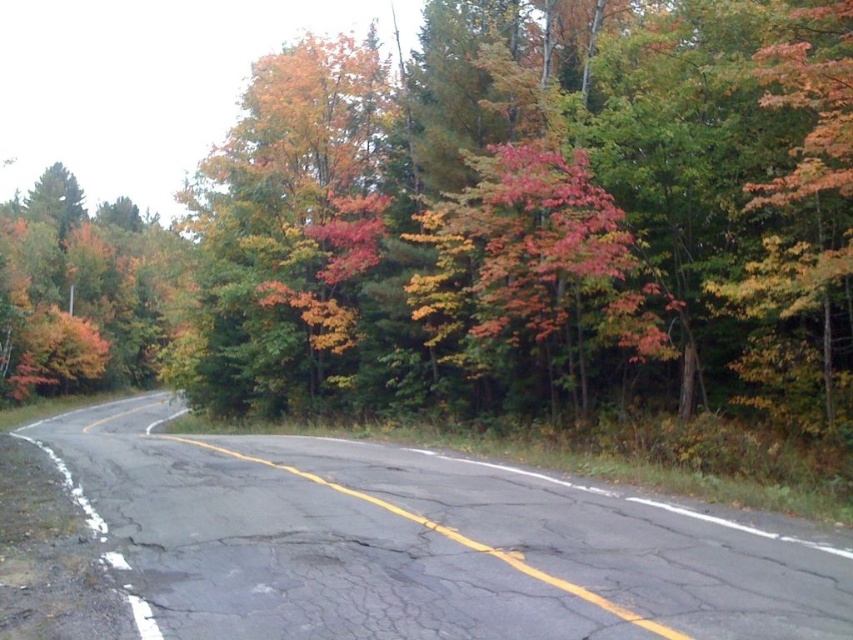
Question: Does autumn foliage at center have a larger size compared to autumn leaves at center?

Choices:
 (A) yes
 (B) no

Answer: (A)

Question: Can you confirm if autumn foliage at center is positioned to the left of autumn leaves at center?

Choices:
 (A) no
 (B) yes

Answer: (B)

Question: Among these objects, which one is farthest from the camera?

Choices:
 (A) autumn foliage at center
 (B) autumn leaves at center

Answer: (B)

Question: Does autumn foliage at center lie in front of autumn leaves at center?

Choices:
 (A) no
 (B) yes

Answer: (B)

Question: Which point is closer to the camera?

Choices:
 (A) (57, 268)
 (B) (337, 312)

Answer: (B)